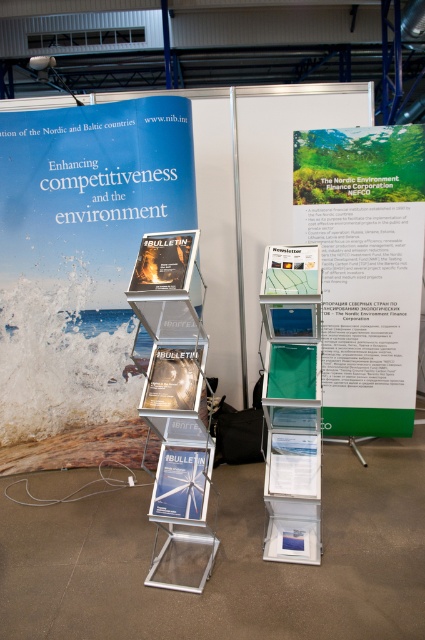
Question: Is matte white poster at center positioned in front of matte plastic bulletin at center?

Choices:
 (A) yes
 (B) no

Answer: (B)

Question: Which point is farther to the camera?

Choices:
 (A) (158, 371)
 (B) (331, 241)
 (C) (175, 486)
 (D) (68, 182)

Answer: (B)

Question: Which of the following is the closest to the observer?

Choices:
 (A) (178, 243)
 (B) (407, 234)
 (C) (112, 109)

Answer: (A)

Question: Can you confirm if green paper at upper right is positioned to the left of matte silver bulletin at center?

Choices:
 (A) no
 (B) yes

Answer: (A)

Question: Is green paper at upper right behind matte silver bulletin at center?

Choices:
 (A) yes
 (B) no

Answer: (A)

Question: Which object appears closest to the camera in this image?

Choices:
 (A) matte plastic bulletin at center
 (B) matte silver bulletin at center
 (C) blue paper poster at center

Answer: (A)